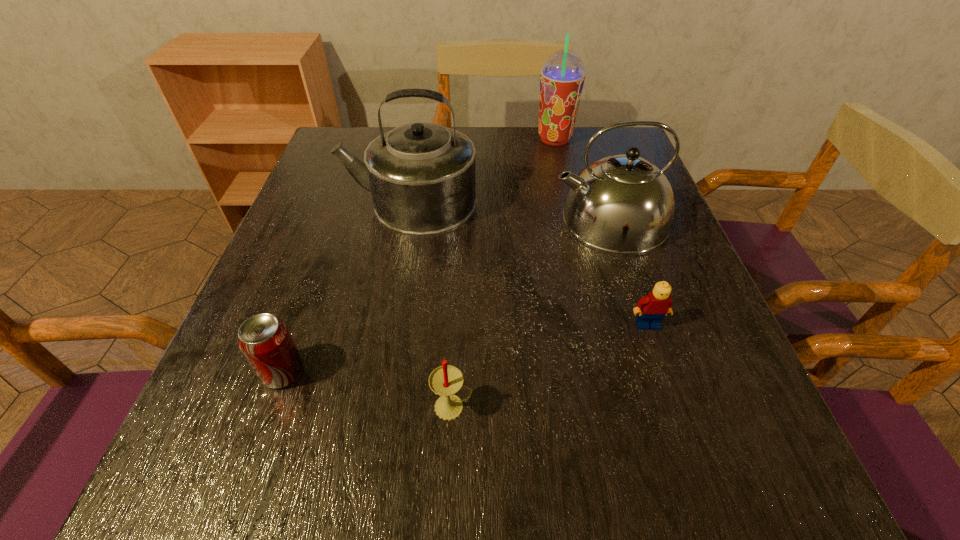
The height and width of the screenshot is (540, 960). I want to click on vacant region between the right kettle and the soda can, so click(x=446, y=295).

This screenshot has height=540, width=960. I want to click on empty space between the left kettle and the third nearest object, so click(x=528, y=264).

The image size is (960, 540). In order to click on free spot between the left kettle and the nearest object in this screenshot , I will do `click(431, 305)`.

Find the location of `empty space that is in between the soda can and the left kettle`. empty space that is in between the soda can and the left kettle is located at coordinates (347, 287).

Where is `vacant region between the candle and the fifth farthest object`? This screenshot has width=960, height=540. vacant region between the candle and the fifth farthest object is located at coordinates (368, 389).

At what (x,y) coordinates should I click in order to perform the action: click on free space between the second nearest object and the candle. Please return your answer as a coordinate pair (x, y). This screenshot has height=540, width=960. Looking at the image, I should click on (368, 389).

Locate an element on the screen. This screenshot has width=960, height=540. free area in between the second nearest object and the candle is located at coordinates (368, 389).

You are a GUI agent. You are given a task and a screenshot of the screen. Output one action in this format:
    pyautogui.click(x=<x>, y=<y>)
    Task: Click on the vacant area that lies between the right kettle and the fourth farthest object
    The height and width of the screenshot is (540, 960).
    Given the screenshot: What is the action you would take?
    [629, 272]

At what (x,y) coordinates should I click in order to perform the action: click on free space between the left kettle and the nearest object. Please return your answer as a coordinate pair (x, y). Image resolution: width=960 pixels, height=540 pixels. Looking at the image, I should click on (431, 305).

Identify the location of object that can be found as the fifth closest to the left kettle. This screenshot has width=960, height=540. (446, 380).